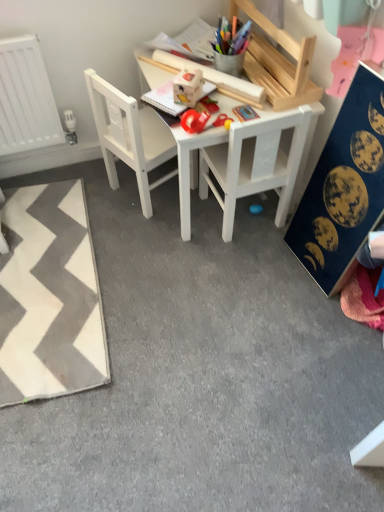
Question: Is white matte chair at center, the second chair from the right, at the left side of dark blue fabric with celestial prints at right?

Choices:
 (A) yes
 (B) no

Answer: (A)

Question: Considering the relative positions of white matte chair at center, which ranks as the 1th chair in left-to-right order, and dark blue fabric with celestial prints at right in the image provided, is white matte chair at center, which ranks as the 1th chair in left-to-right order, to the right of dark blue fabric with celestial prints at right from the viewer's perspective?

Choices:
 (A) no
 (B) yes

Answer: (A)

Question: Does white matte chair at center, which ranks as the 1th chair in left-to-right order, turn towards dark blue fabric with celestial prints at right?

Choices:
 (A) yes
 (B) no

Answer: (B)

Question: Is white matte chair at center, the second chair from the right, bigger than dark blue fabric with celestial prints at right?

Choices:
 (A) no
 (B) yes

Answer: (B)

Question: Is white matte chair at center, the second chair from the right, facing away from dark blue fabric with celestial prints at right?

Choices:
 (A) no
 (B) yes

Answer: (A)

Question: From the image's perspective, is white matte chair at center, which ranks as the 1th chair in left-to-right order, located above dark blue fabric with celestial prints at right?

Choices:
 (A) yes
 (B) no

Answer: (A)

Question: Is white matte chair at center, placed as the second chair when sorted from left to right, positioned behind white matte chair at center, which ranks as the 1th chair in left-to-right order?

Choices:
 (A) yes
 (B) no

Answer: (B)

Question: Is white matte chair at center, placed as the second chair when sorted from left to right, located outside white matte chair at center, which ranks as the 1th chair in left-to-right order?

Choices:
 (A) yes
 (B) no

Answer: (A)

Question: Considering the relative positions of white matte chair at center, placed as the second chair when sorted from left to right, and white matte chair at center, the second chair from the right, in the image provided, is white matte chair at center, placed as the second chair when sorted from left to right, to the right of white matte chair at center, the second chair from the right, from the viewer's perspective?

Choices:
 (A) no
 (B) yes

Answer: (B)

Question: Are white matte chair at center, which is the first chair in right-to-left order, and white matte chair at center, the second chair from the right, located far from each other?

Choices:
 (A) no
 (B) yes

Answer: (A)

Question: Does white matte chair at center, which is the first chair in right-to-left order, appear on the left side of white matte chair at center, which ranks as the 1th chair in left-to-right order?

Choices:
 (A) yes
 (B) no

Answer: (B)

Question: Can you confirm if white matte chair at center, which is the first chair in right-to-left order, is shorter than white matte chair at center, the second chair from the right?

Choices:
 (A) no
 (B) yes

Answer: (B)

Question: Can you confirm if white zigzag rug at lower left is positioned to the right of white wooden table at center?

Choices:
 (A) yes
 (B) no

Answer: (B)